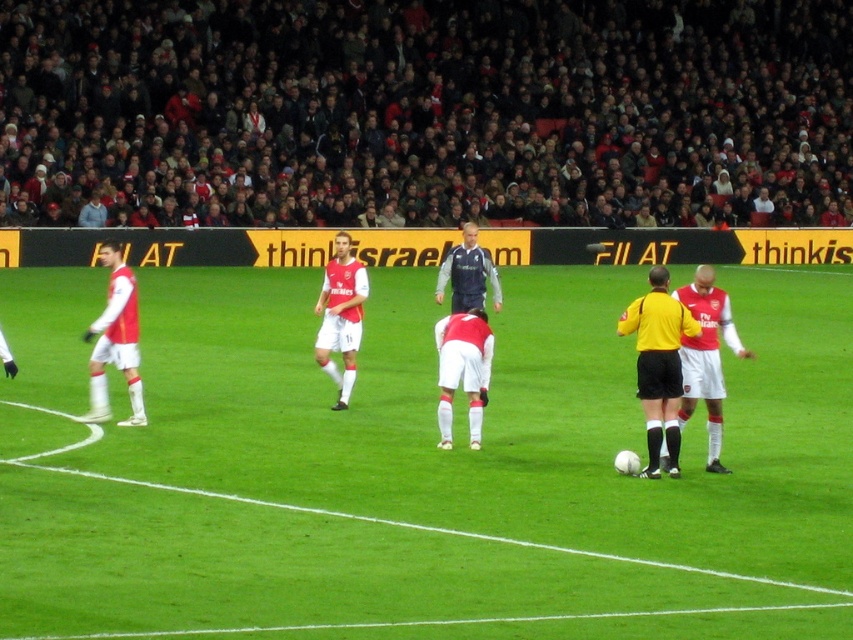
Is the position of white jersey at center more distant than that of yellow jersey at center?

Yes, white jersey at center is further from the viewer.

Does white jersey at center have a greater height compared to yellow jersey at center?

Yes, white jersey at center is taller than yellow jersey at center.

Where is `white jersey at center`? The image size is (853, 640). white jersey at center is located at coordinates (426, 112).

Is green grass field at center behind red matte jersey at center?

No.

Is green grass field at center taller than red matte jersey at center?

Indeed, green grass field at center has a greater height compared to red matte jersey at center.

Does point (241, 513) come in front of point (704, 268)?

Yes.

This screenshot has width=853, height=640. Identify the location of green grass field at center. (421, 468).

How far apart are matte white shorts at left and dark blue jersey at center?

The distance of matte white shorts at left from dark blue jersey at center is 5.89 meters.

Find the location of `matte white shorts at left`. matte white shorts at left is located at coordinates (115, 340).

Does point (134, 344) come behind point (440, 296)?

No, (134, 344) is closer to viewer.

Locate an element on the screen. matte white shorts at left is located at coordinates (x=115, y=340).